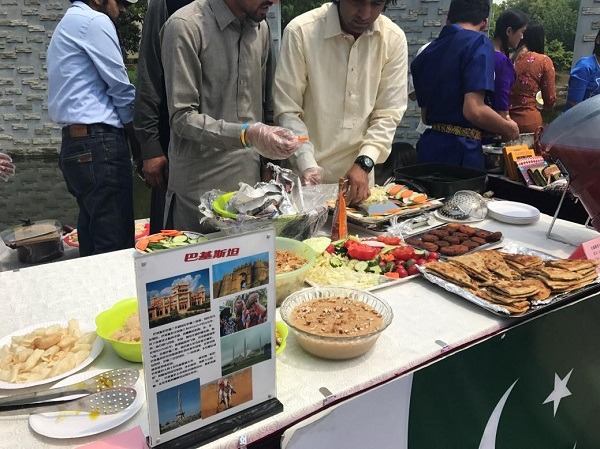
At what (x,y) coordinates should I click in order to perform the action: click on white oval dish. Please return your answer as a coordinate pair (x, y). The image size is (600, 449). Looking at the image, I should click on (91, 430), (79, 364).